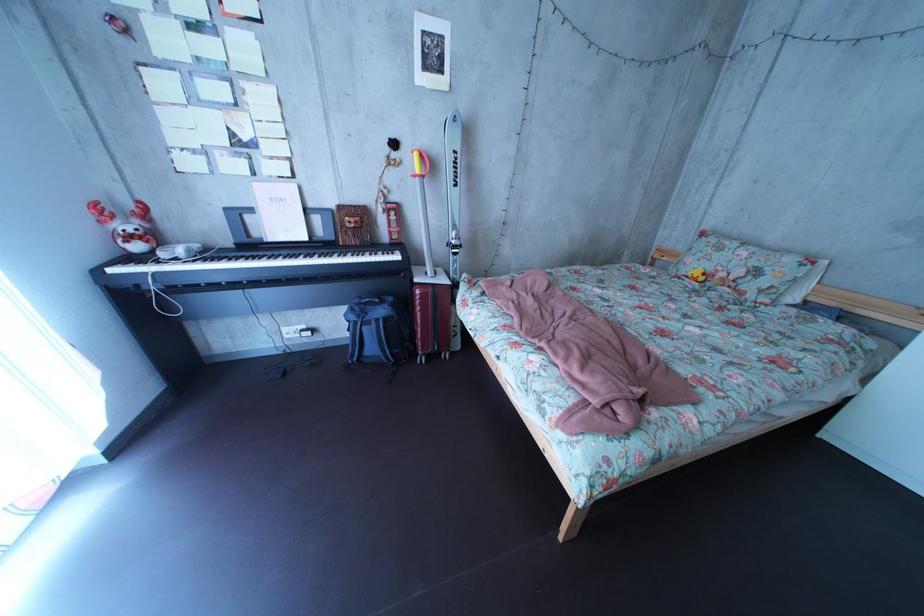
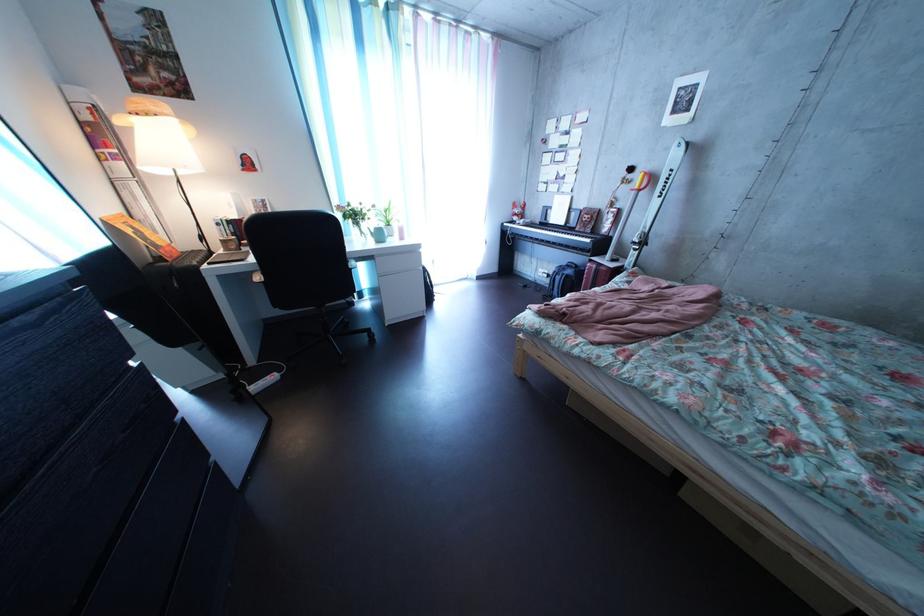
Find the pixel in the second image that matches pixel 299 338 in the first image.

(554, 278)